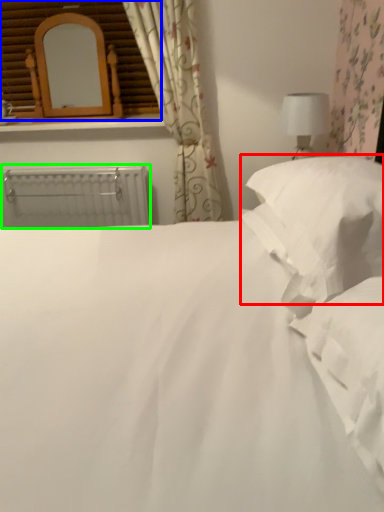
Question: Which is farther away from pillow (highlighted by a red box)? window frame (highlighted by a blue box) or radiator (highlighted by a green box)?

Choices:
 (A) window frame
 (B) radiator

Answer: (A)